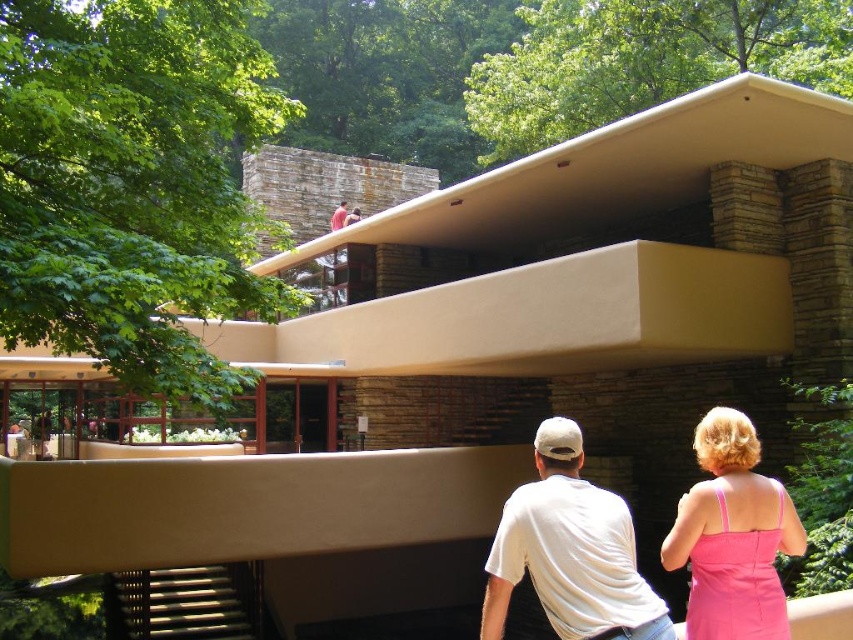
From the picture: Between white cotton shirt at center and matte stone man at upper center, which one is positioned higher?

matte stone man at upper center

Does white cotton shirt at center have a lesser width compared to matte stone man at upper center?

No, white cotton shirt at center is not thinner than matte stone man at upper center.

Is point (572, 564) positioned behind point (335, 209)?

No.

This screenshot has width=853, height=640. I want to click on white cotton shirt at center, so click(x=570, y=552).

Does white cotton shirt at center have a greater height compared to pink satin dress at lower right?

Indeed, white cotton shirt at center has a greater height compared to pink satin dress at lower right.

Can you confirm if white cotton shirt at center is positioned to the right of pink satin dress at lower right?

Incorrect, white cotton shirt at center is not on the right side of pink satin dress at lower right.

Which is behind, point (567, 612) or point (693, 616)?

Positioned behind is point (693, 616).

I want to click on white cotton shirt at center, so click(x=570, y=552).

Is pink satin dress at lower right below matte stone man at upper center?

Indeed, pink satin dress at lower right is positioned under matte stone man at upper center.

Does pink satin dress at lower right have a greater height compared to matte stone man at upper center?

No.

Does point (695, 509) come in front of point (344, 216)?

Yes, it is in front of point (344, 216).

At what (x,y) coordinates should I click in order to perform the action: click on pink satin dress at lower right. Please return your answer as a coordinate pair (x, y). The width and height of the screenshot is (853, 640). Looking at the image, I should click on (732, 536).